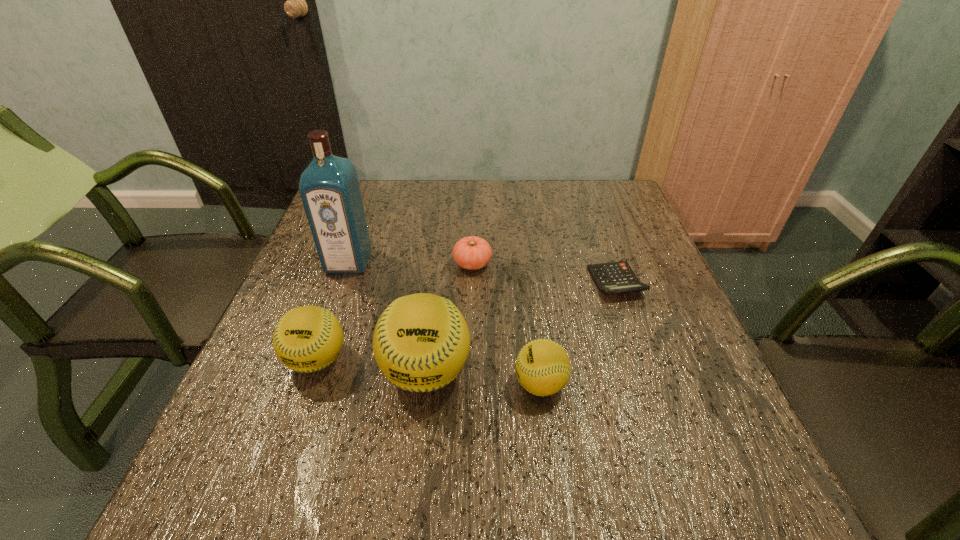
Image resolution: width=960 pixels, height=540 pixels. I want to click on vacant space at the far edge, so click(551, 186).

Locate an element on the screen. This screenshot has height=540, width=960. vacant region at the near edge of the desktop is located at coordinates (447, 414).

Find the location of a particular element. The height and width of the screenshot is (540, 960). free space at the left edge of the desktop is located at coordinates (304, 296).

In the image, there is a desktop. In order to click on vacant space at the right edge in this screenshot , I will do `click(671, 335)`.

In the image, there is a desktop. Identify the location of vacant space at the far left corner. The image size is (960, 540). (382, 196).

Where is `free location at the near right corner of the desktop`? The width and height of the screenshot is (960, 540). free location at the near right corner of the desktop is located at coordinates (674, 413).

Find the location of a particular element. free area in between the shortest object and the liquor is located at coordinates (482, 272).

Locate an element on the screen. This screenshot has width=960, height=540. unoccupied area between the shortest softball and the second softball from right to left is located at coordinates (483, 377).

At what (x,y) coordinates should I click in order to perform the action: click on unoccupied position between the fifth tallest object and the rightmost object. Please return your answer as a coordinate pair (x, y). The height and width of the screenshot is (540, 960). Looking at the image, I should click on (544, 273).

The image size is (960, 540). Identify the location of free area in between the rightmost object and the tomato. 544,273.